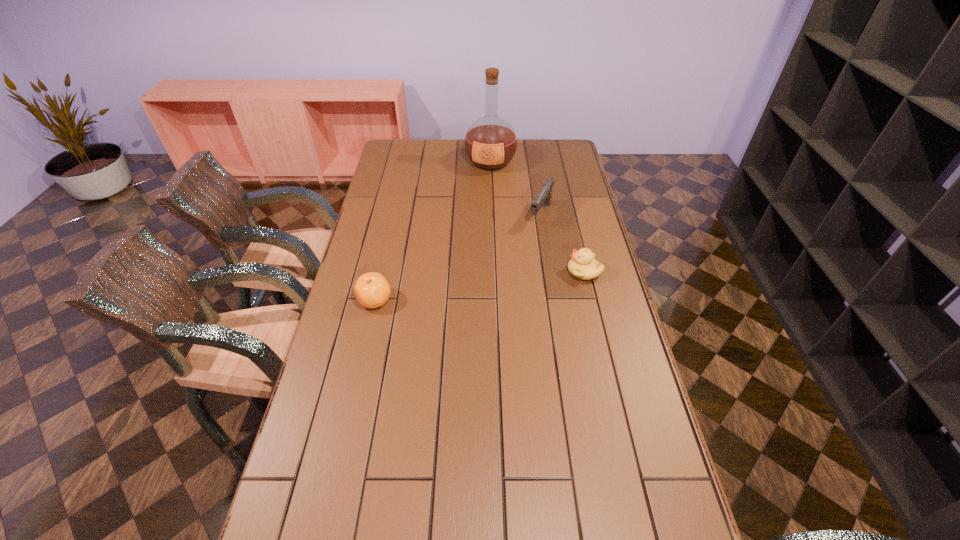
Where is `vacant space that satisfies the following two spatial constraints: 1. on the front side of the duckling; 2. on the beak of the third object from right to left`? The width and height of the screenshot is (960, 540). vacant space that satisfies the following two spatial constraints: 1. on the front side of the duckling; 2. on the beak of the third object from right to left is located at coordinates (494, 272).